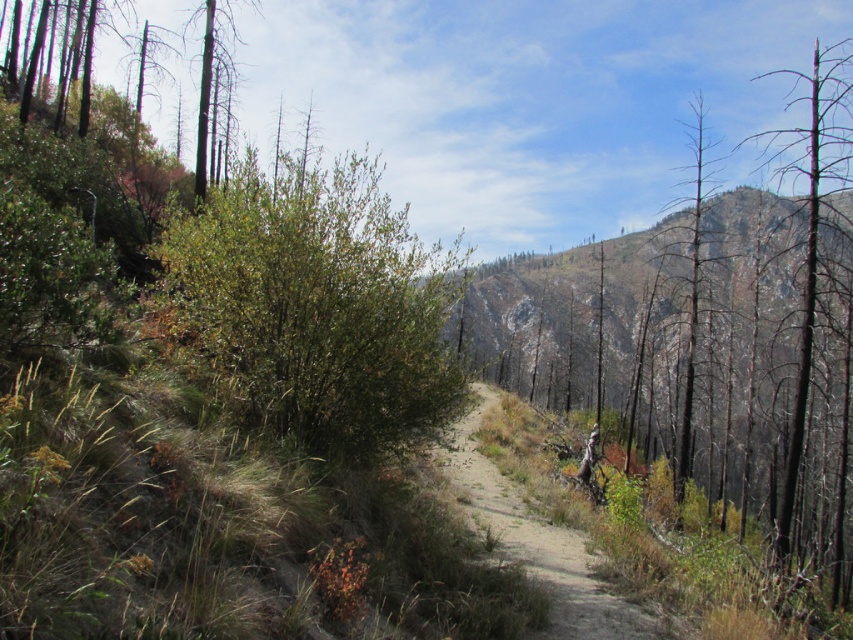
Does green leafy bush at center appear on the right side of bare wood tree at right?

In fact, green leafy bush at center is to the left of bare wood tree at right.

Between green leafy bush at center and bare wood tree at right, which one appears on the right side from the viewer's perspective?

From the viewer's perspective, bare wood tree at right appears more on the right side.

This screenshot has height=640, width=853. In order to click on green leafy bush at center in this screenshot , I will do `click(318, 307)`.

Can you confirm if green leafy bush at center is taller than charred wood tree at right?

Incorrect, green leafy bush at center's height is not larger of charred wood tree at right's.

Can you confirm if green leafy bush at center is positioned to the right of charred wood tree at right?

In fact, green leafy bush at center is to the left of charred wood tree at right.

Image resolution: width=853 pixels, height=640 pixels. Find the location of `green leafy bush at center`. green leafy bush at center is located at coordinates (318, 307).

Identify the location of green leafy bush at center. Image resolution: width=853 pixels, height=640 pixels. (318, 307).

Can you confirm if charred wood tree at right is thinner than bare wood tree at right?

No, charred wood tree at right is not thinner than bare wood tree at right.

Who is more distant from viewer, (827,150) or (692,250)?

The point (692,250) is more distant.

Which is behind, point (809, 134) or point (698, 230)?

Point (698, 230)

Locate an element on the screen. This screenshot has height=640, width=853. charred wood tree at right is located at coordinates (813, 218).